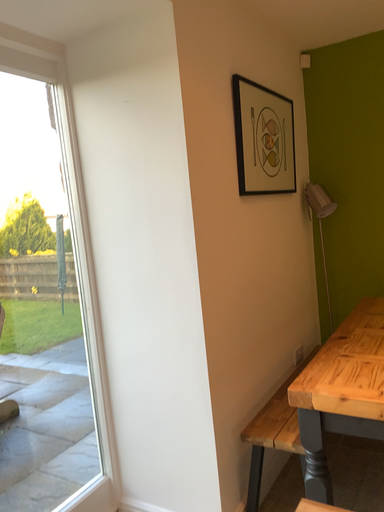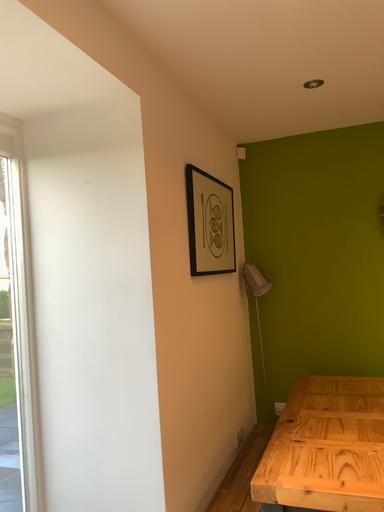
Question: Which way did the camera rotate in the video?

Choices:
 (A) rotated left
 (B) rotated right

Answer: (B)